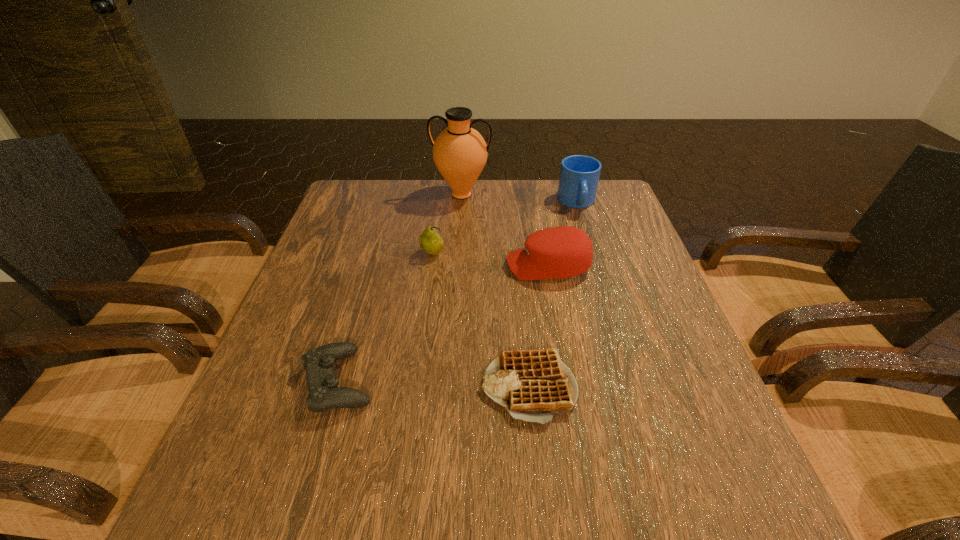
Find the location of a particular element. The height and width of the screenshot is (540, 960). vacant region between the cap and the shortest object is located at coordinates (539, 326).

Locate an element on the screen. vacant point located between the cap and the pear is located at coordinates 491,260.

Locate an element on the screen. free space between the shortest object and the fifth shortest object is located at coordinates (553, 294).

Where is `vacant area that lies between the fifth shortest object and the pear`? Image resolution: width=960 pixels, height=540 pixels. vacant area that lies between the fifth shortest object and the pear is located at coordinates (505, 228).

Identify the location of free space between the pear and the control. The width and height of the screenshot is (960, 540). (386, 318).

Locate an element on the screen. Image resolution: width=960 pixels, height=540 pixels. vacant area between the control and the shortest object is located at coordinates (434, 384).

Select which object is the third closest to the waffle. Please provide its 2D coordinates. Your answer should be formatted as a tuple, i.e. [(x, y)], where the tuple contains the x and y coordinates of a point satisfying the conditions above.

[(430, 241)]

Locate which object is the closest to the tallest object. Please provide its 2D coordinates. Your answer should be formatted as a tuple, i.e. [(x, y)], where the tuple contains the x and y coordinates of a point satisfying the conditions above.

[(430, 241)]

Where is `free spot that satisfies the following two spatial constraints: 1. on the side of the second tallest object with the handle; 2. on the front-facing side of the cap`? This screenshot has width=960, height=540. free spot that satisfies the following two spatial constraints: 1. on the side of the second tallest object with the handle; 2. on the front-facing side of the cap is located at coordinates (597, 266).